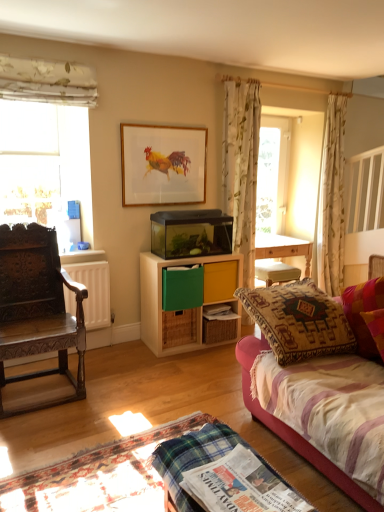
Locate an element on the screen. This screenshot has width=384, height=512. free space in front of green woven drawer at center, which is the 1th drawer in bottom-to-top order is located at coordinates (184, 357).